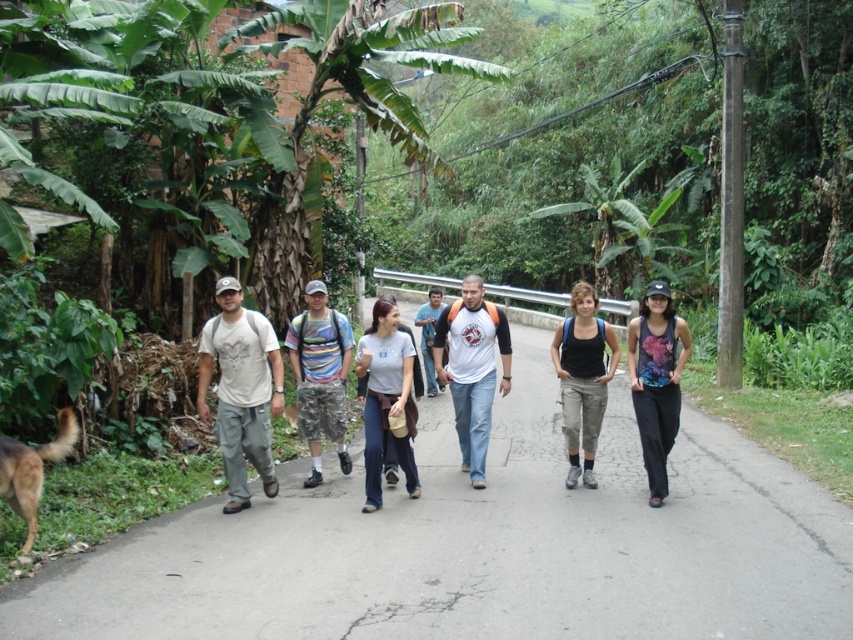
Question: Which of these objects is positioned farthest from the black cotton tank top at center?

Choices:
 (A) striped fabric shirt at center
 (B) black tank top at center

Answer: (A)

Question: Can you confirm if black tank top at center is positioned above brown fur dog at lower left?

Choices:
 (A) yes
 (B) no

Answer: (A)

Question: Which of the following is the farthest from the observer?

Choices:
 (A) (567, 336)
 (B) (405, 474)
 (C) (300, 355)
 (D) (426, 314)

Answer: (D)

Question: Does matte khaki pants at center have a larger size compared to white cotton t-shirt at center?

Choices:
 (A) no
 (B) yes

Answer: (B)

Question: Which point is closer to the camera taking this photo?

Choices:
 (A) (351, 346)
 (B) (659, 332)
 (C) (64, 452)

Answer: (C)

Question: Can you confirm if brown fur dog at lower left is thinner than white t-shirt at center?

Choices:
 (A) no
 (B) yes

Answer: (B)